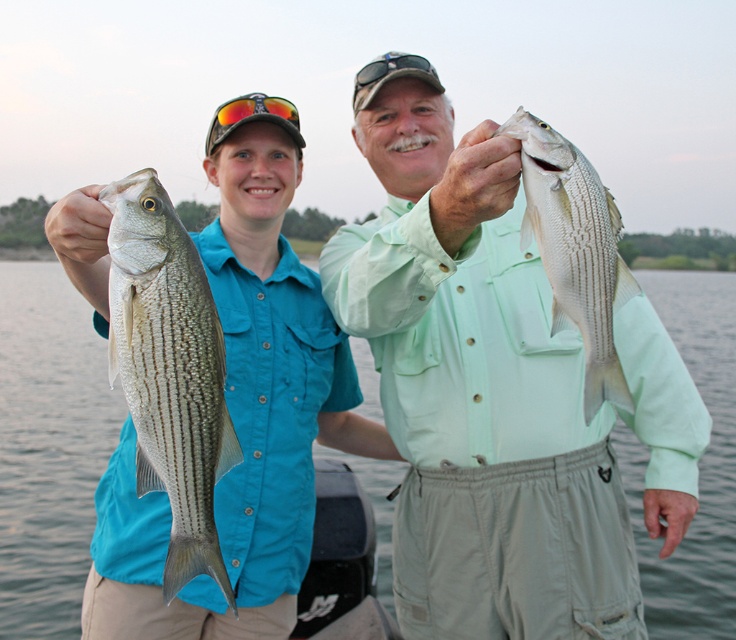
Question: Among these points, which one is farthest from the camera?

Choices:
 (A) (40, 419)
 (B) (567, 276)
 (C) (208, 572)
 (D) (222, 118)

Answer: (A)

Question: Considering the relative positions of matte green shirt at center and matte blue shirt at center in the image provided, where is matte green shirt at center located with respect to matte blue shirt at center?

Choices:
 (A) below
 (B) above

Answer: (B)

Question: Is matte blue shirt at center in front of shiny silver fish at left?

Choices:
 (A) no
 (B) yes

Answer: (A)

Question: Based on their relative distances, which object is farther from the white striped fish at upper center?

Choices:
 (A) matte blue shirt at center
 (B) shiny silver fish at left
 (C) matte green shirt at center

Answer: (A)

Question: Which of these objects is positioned closest to the shiny silver fish at left?

Choices:
 (A) white striped fish at upper center
 (B) matte blue shirt at center
 (C) matte green shirt at center

Answer: (A)

Question: Is the position of matte green shirt at center less distant than that of clear water at center?

Choices:
 (A) no
 (B) yes

Answer: (B)